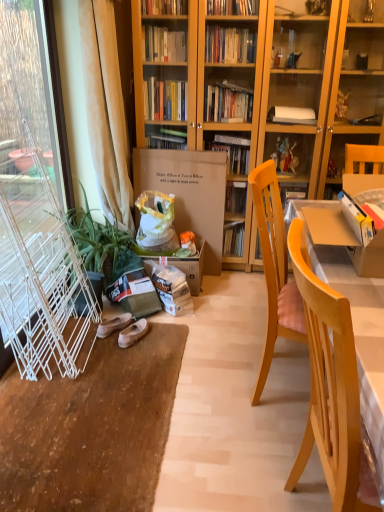
Question: Is white wire screen door at left taller or shorter than white leather ballet flats at lower left, the second footwear positioned from the left?

Choices:
 (A) short
 (B) tall

Answer: (B)

Question: From the image's perspective, is white wire screen door at left located above or below white leather ballet flats at lower left, which is counted as the 1th footwear, starting from the right?

Choices:
 (A) below
 (B) above

Answer: (B)

Question: Which object is the closest to the brown cardboard box at center?

Choices:
 (A) white fabric slipper at lower left, acting as the 1th footwear starting from the left
 (B) light wood chair at right
 (C) green leafy plant at left
 (D) white wire screen door at left
 (E) beige fabric curtain at left

Answer: (E)

Question: Which object is the farthest from the white fabric slipper at lower left, the 2th footwear viewed from the right?

Choices:
 (A) white wire screen door at left
 (B) light wood chair at right
 (C) green leafy plant at left
 (D) white leather ballet flats at lower left, which is counted as the 1th footwear, starting from the right
 (E) brown cardboard box at center

Answer: (B)